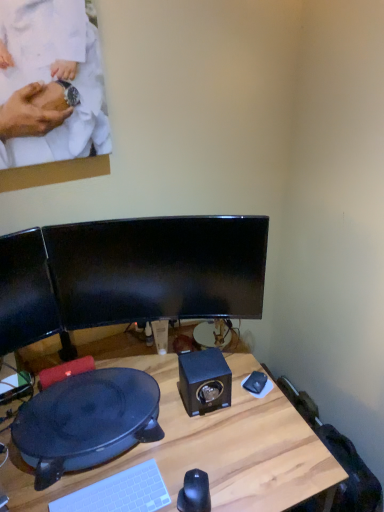
In order to click on empty space that is ontop of black plastic wok at lower left (from a real-world perspective) in this screenshot , I will do `click(82, 413)`.